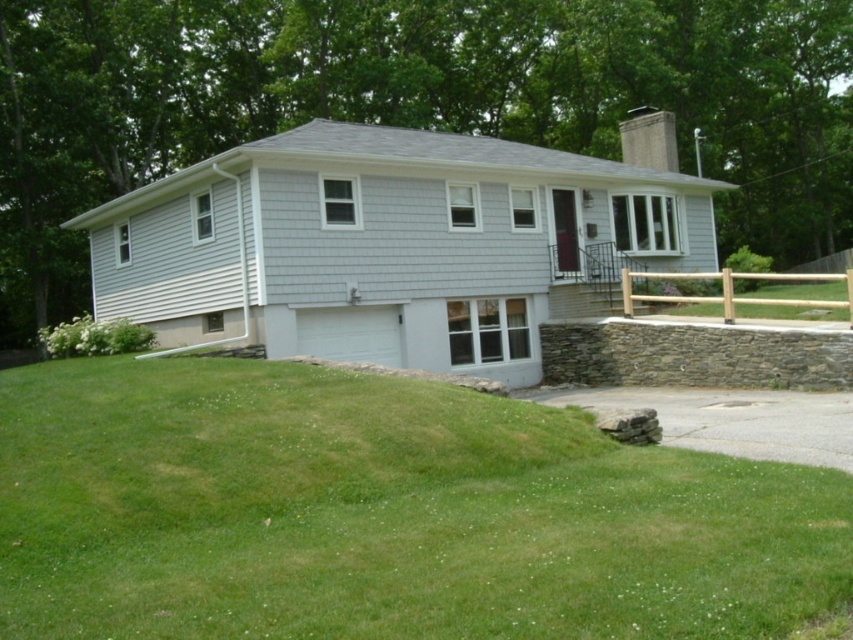
You are a gardener planning to plant flowers in the area between the green grass at lower left and the gray asphalt driveway at lower right. Which area has more space available for planting?

The green grass at lower left has a larger size compared to the gray asphalt driveway at lower right, so there is more space available for planting in the green grass at lower left.

You are standing at the driveway and want to walk towards the green grass at lower left. Which direction should you walk relative to the brown wooden fence at right?

You should walk towards the left side of the brown wooden fence at right since the green grass at lower left is located below it, which means it is positioned to the left and closer to the ground level.

You are a delivery person arriving at this house and need to park your van. The van is 2 meters wide. The driveway is narrow. Can you park your van on the gray asphalt driveway at lower right without blocking the brown wooden fence at right?

The gray asphalt driveway at lower right is in front of the brown wooden fence at right, so parking the van there would block the fence. Choose another parking spot.